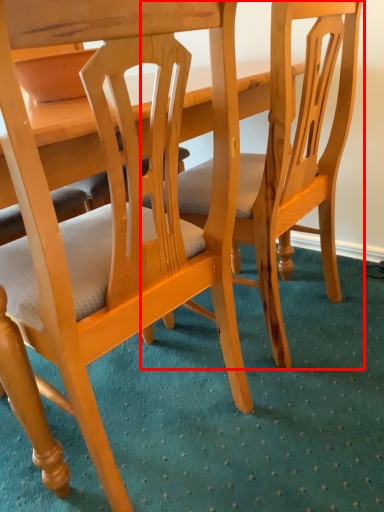
Question: In this image, where is chair (annotated by the red box) located relative to chair?

Choices:
 (A) right
 (B) left

Answer: (A)